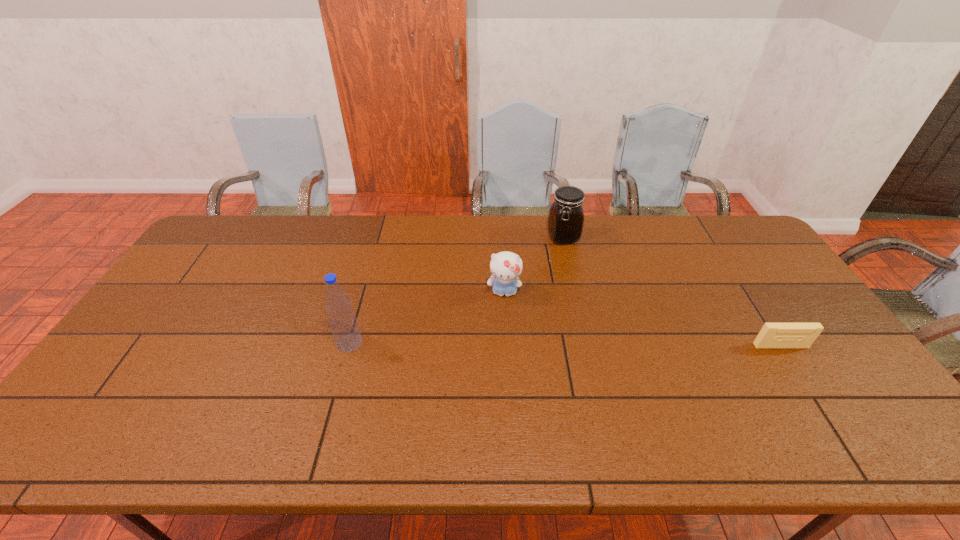
The height and width of the screenshot is (540, 960). I want to click on free space located 0.130m on the lid of the third object from left to right, so click(x=582, y=274).

This screenshot has height=540, width=960. What are the coordinates of `free space located on the lid of the third object from left to right` in the screenshot? It's located at (607, 322).

Where is `vacant space situated on the lid of the third object from left to right`? vacant space situated on the lid of the third object from left to right is located at coordinates (596, 302).

In order to click on free region located 0.170m on the front-facing side of the kitten in this screenshot , I will do `click(501, 348)`.

The width and height of the screenshot is (960, 540). In order to click on vacant region located on the front-facing side of the kitten in this screenshot , I will do `click(502, 331)`.

I want to click on free location located 0.250m on the front-facing side of the kitten, so click(500, 373).

I want to click on object located in the far edge section of the desktop, so click(566, 216).

Image resolution: width=960 pixels, height=540 pixels. I want to click on object that is at the right edge, so click(x=772, y=335).

Identify the location of vacant region at the far edge of the desktop. (680, 246).

Where is `free location at the near edge of the desktop`? This screenshot has height=540, width=960. free location at the near edge of the desktop is located at coordinates (394, 396).